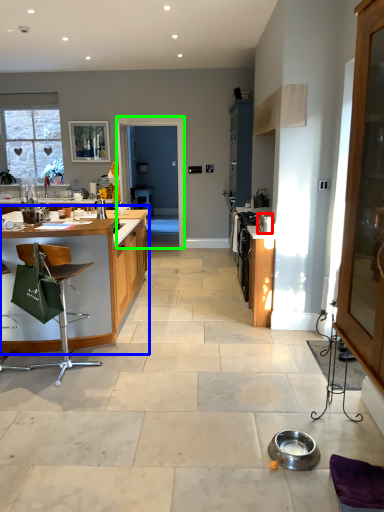
Question: Which object is positioned closest to appliance (highlighted by a red box)? Select from table (highlighted by a blue box) and screen door (highlighted by a green box).

Choices:
 (A) table
 (B) screen door

Answer: (A)